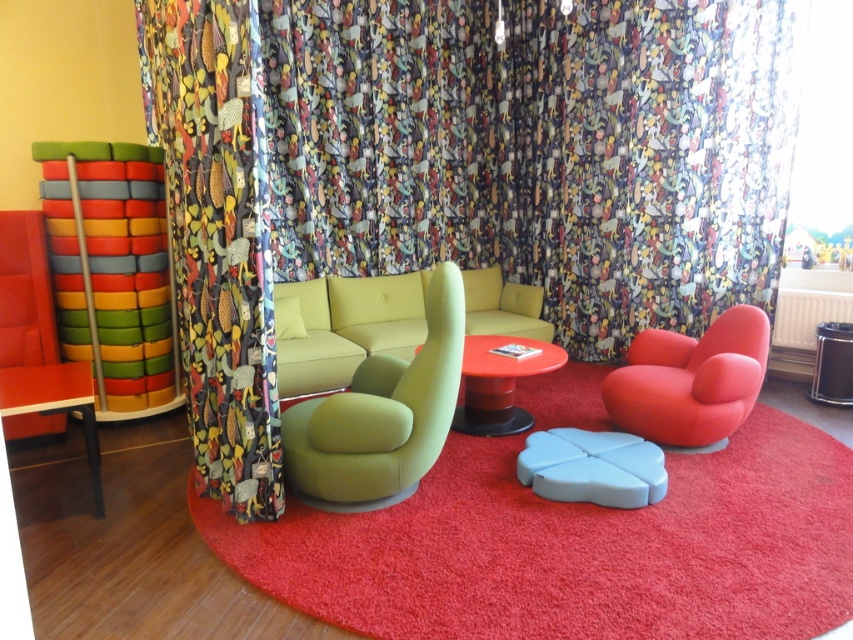
You are sitting on the matte green couch at center and want to reach the matte red swivel chair at lower right. Which direction should you move to get there?

You should move to the right to reach the matte red swivel chair at lower right because the matte green couch at center is positioned on the left side of it.

You are planning to rearrange the furniture in this room. If you want to place a new rectangular sofa that is 1.2 meters wide between the matte red swivel chair at lower right and the matte red table at center, will there be enough space considering their widths?

The matte red swivel chair at lower right is wider than the matte red table at center. Since the sofa is 1.2 meters wide, the total width required would depend on the combined width of both objects. However, without knowing their exact widths, it is impossible to determine if there is sufficient space. Please provide the specific measurements of the objects to calculate accurately.